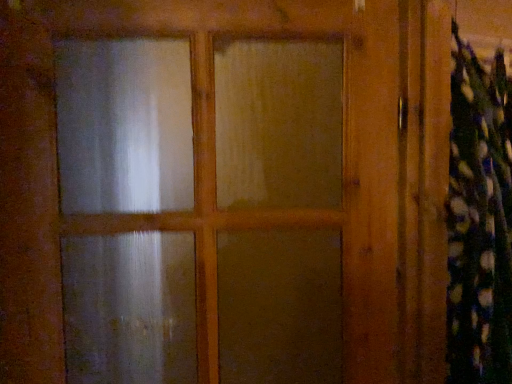
At what (x,y) coordinates should I click in order to perform the action: click on dark green floral fabric at right. Please return your answer as a coordinate pair (x, y). Looking at the image, I should click on (479, 220).

This screenshot has height=384, width=512. Describe the element at coordinates (479, 220) in the screenshot. I see `dark green floral fabric at right` at that location.

Where is `dark green floral fabric at right`? This screenshot has width=512, height=384. dark green floral fabric at right is located at coordinates (479, 220).